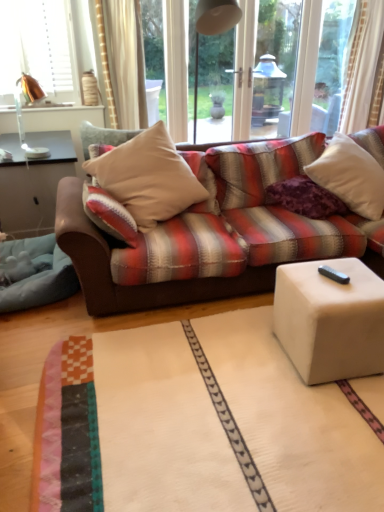
Identify the location of free space in front of black plastic remote control at lower right. The width and height of the screenshot is (384, 512). (344, 292).